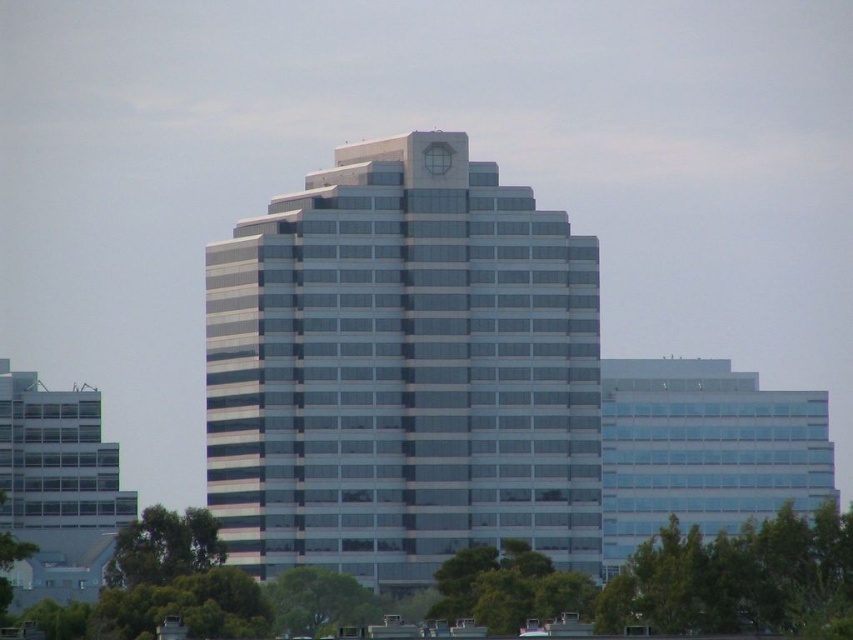
Question: Does matte glass building at left appear under green leafy tree at lower left?

Choices:
 (A) yes
 (B) no

Answer: (B)

Question: Can you confirm if green leafy tree at lower left is wider than green leafy tree at lower center?

Choices:
 (A) no
 (B) yes

Answer: (B)

Question: In this image, where is transparent glass building at right located relative to matte glass building at left?

Choices:
 (A) below
 (B) above

Answer: (B)

Question: Which point is closer to the camera taking this photo?

Choices:
 (A) (802, 403)
 (B) (125, 588)
 (C) (325, 625)
 (D) (502, 596)

Answer: (D)

Question: Considering the real-world distances, which object is farthest from the green leafy tree at center?

Choices:
 (A) green leafy tree at lower left
 (B) transparent glass building at right
 (C) glassy reflective building at center
 (D) green leafy tree at lower center

Answer: (C)

Question: Which point appears farthest from the camera in this image?

Choices:
 (A) (839, 554)
 (B) (335, 580)

Answer: (A)